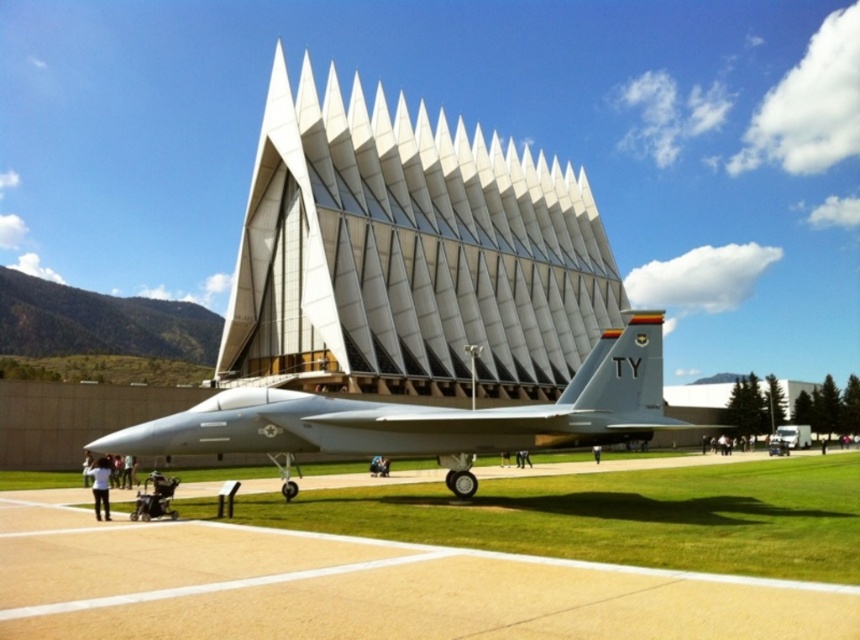
Based on the photo, is white matte building at center shorter than silver metallic jet at center?

In fact, white matte building at center may be taller than silver metallic jet at center.

Can you confirm if white matte building at center is thinner than silver metallic jet at center?

In fact, white matte building at center might be wider than silver metallic jet at center.

Between point (361, 256) and point (487, 412), which one is positioned behind?

Point (361, 256)

At what (x,y) coordinates should I click in order to perform the action: click on white matte building at center. Please return your answer as a coordinate pair (x, y). The width and height of the screenshot is (860, 640). Looking at the image, I should click on (408, 256).

Is white matte building at center wider than smooth concrete tarmac at center?

Yes, white matte building at center is wider than smooth concrete tarmac at center.

Who is positioned more to the left, white matte building at center or smooth concrete tarmac at center?

From the viewer's perspective, smooth concrete tarmac at center appears more on the left side.

This screenshot has height=640, width=860. What do you see at coordinates (408, 256) in the screenshot?
I see `white matte building at center` at bounding box center [408, 256].

Identify the location of white matte building at center. The height and width of the screenshot is (640, 860). (408, 256).

Does white matte building at center appear under white fabric shirt at lower left?

Incorrect, white matte building at center is not positioned below white fabric shirt at lower left.

Is white matte building at center shorter than white fabric shirt at lower left?

No, white matte building at center is not shorter than white fabric shirt at lower left.

Between point (367, 195) and point (105, 472), which one is positioned in front?

Point (105, 472)

I want to click on white matte building at center, so click(x=408, y=256).